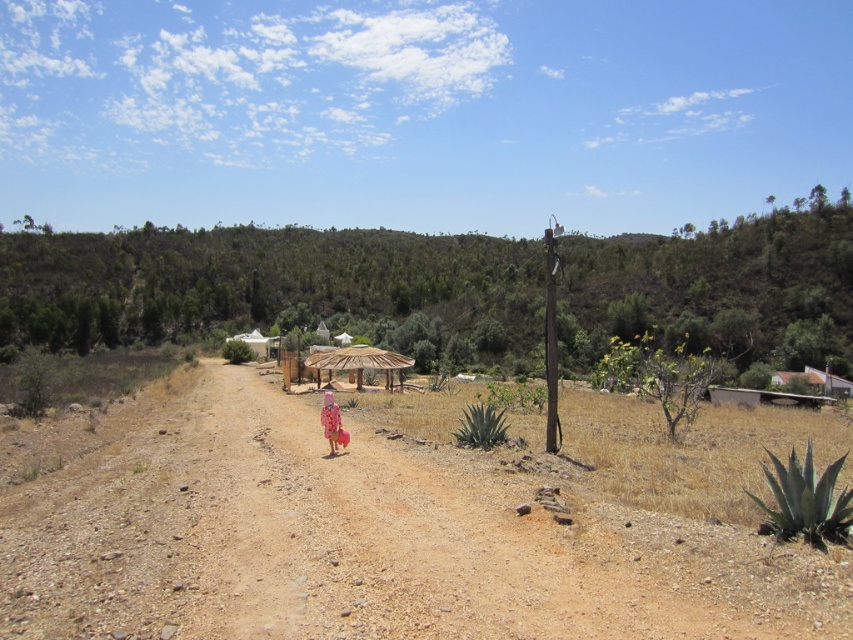
You are a photographer trying to capture the pink fabric dress at center and the brown gravelly dirt field at center in a single shot. Which object should you focus on first if you want to ensure both are in sharp focus?

The brown gravelly dirt field at center is below the pink fabric dress at center, so you should focus on the pink fabric dress at center first to ensure both are in sharp focus.

You are planning to set up a picnic area in the middle of the brown gravelly dirt field at center and the natural straw umbrella at center. Which object should you place first to ensure it fits properly?

The brown gravelly dirt field at center is smaller than the natural straw umbrella at center, so you should place the natural straw umbrella at center first to ensure it fits within the available space.